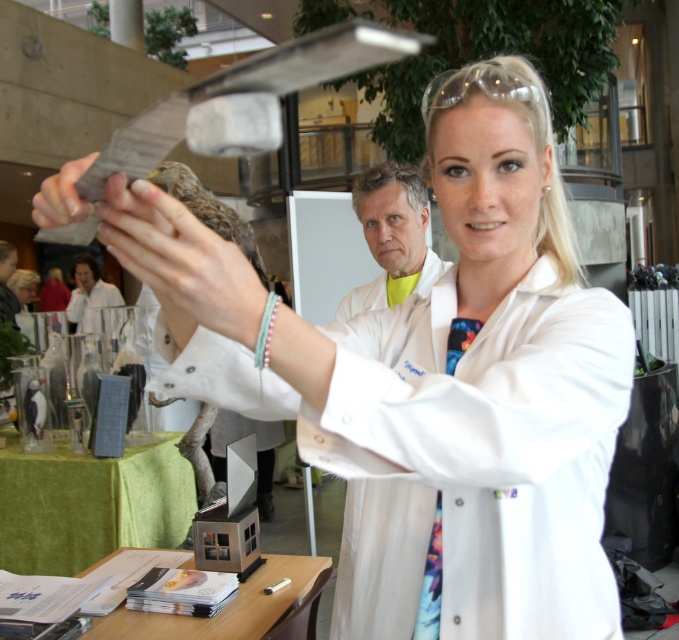
Can you confirm if yellow fabric at center is shorter than matte black glove at upper left?

Incorrect, yellow fabric at center's height does not fall short of matte black glove at upper left's.

Based on the photo, is yellow fabric at center in front of matte black glove at upper left?

No, yellow fabric at center is further to the viewer.

Image resolution: width=679 pixels, height=640 pixels. I want to click on yellow fabric at center, so click(392, 237).

The width and height of the screenshot is (679, 640). What are the coordinates of `yellow fabric at center` in the screenshot? It's located at (392, 237).

Based on the photo, is matte silver bird at center smaller than matte black glove at upper left?

Incorrect, matte silver bird at center is not smaller in size than matte black glove at upper left.

Who is more distant from viewer, (255, 268) or (37, 200)?

Point (255, 268)

Does point (168, 307) come closer to viewer compared to point (86, 214)?

No, it is behind (86, 214).

Identify the location of matte silver bird at center. (213, 212).

Between yellow fabric at center and matte silver bird at center, which one has less height?

yellow fabric at center

Is point (367, 298) closer to camera compared to point (251, 244)?

Yes, it is.

Locate an element on the screen. This screenshot has width=679, height=640. yellow fabric at center is located at coordinates (392, 237).